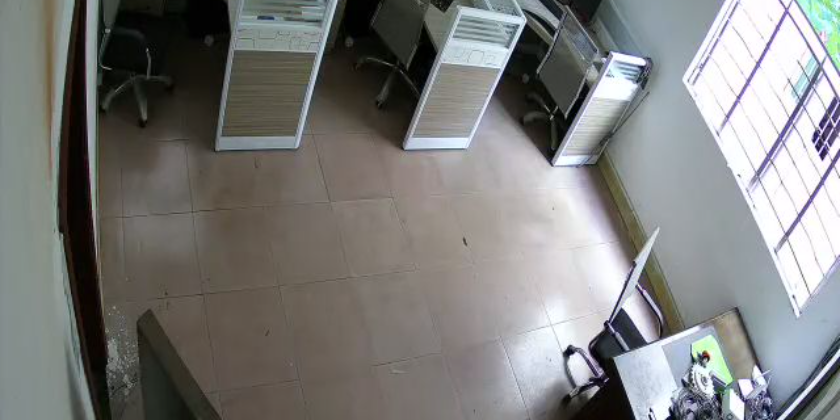
At what (x,y) coordinates should I click in order to perform the action: click on brown tile floor. Please return your answer as a coordinate pair (x, y). Looking at the image, I should click on click(476, 236).